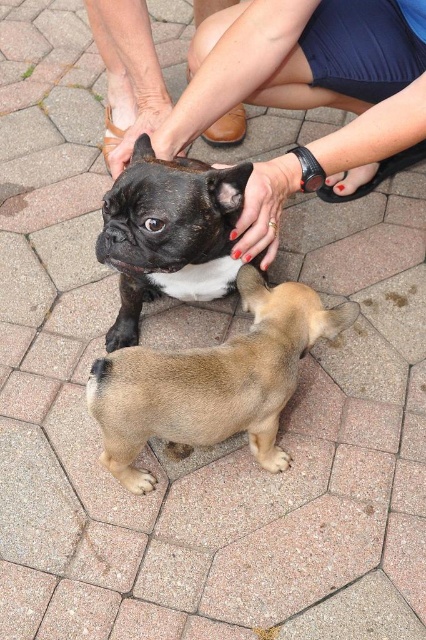
Question: Which object is closer to the camera taking this photo?

Choices:
 (A) black matte paw at lower left
 (B) smooth black dog at center
 (C) shiny black fur at center
 (D) smooth tan dog at center

Answer: (C)

Question: Where is shiny black fur at center located in relation to black matte paw at lower left in the image?

Choices:
 (A) left
 (B) right

Answer: (B)

Question: Which point appears closest to the camera in this image?

Choices:
 (A) (201, 241)
 (B) (244, 35)
 (C) (285, 310)

Answer: (A)

Question: Can you confirm if smooth tan dog at center is positioned above black matte paw at lower left?

Choices:
 (A) no
 (B) yes

Answer: (A)

Question: Observing the image, what is the correct spatial positioning of smooth tan dog at center in reference to shiny black fur at center?

Choices:
 (A) above
 (B) below

Answer: (B)

Question: Which object is farther from the camera taking this photo?

Choices:
 (A) shiny black fur at center
 (B) black matte paw at lower left

Answer: (B)